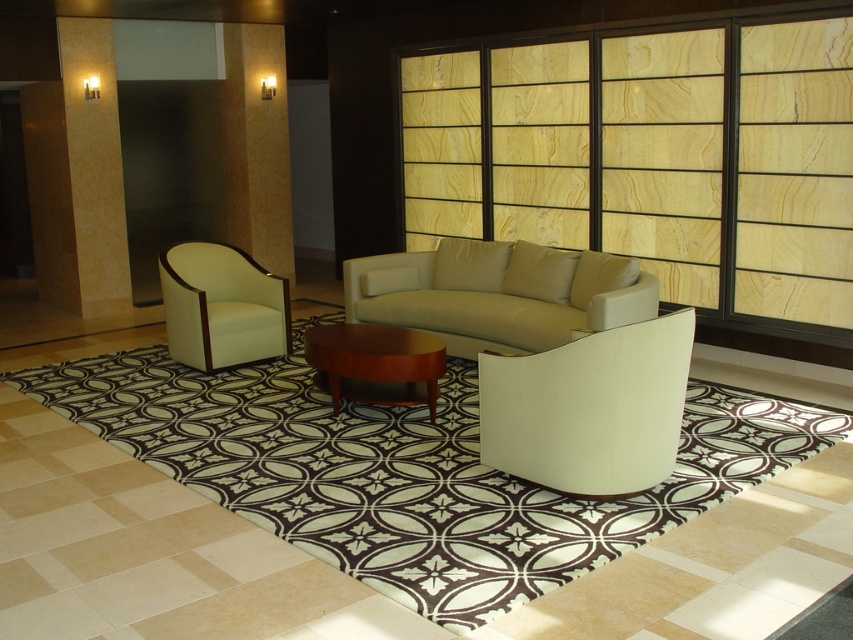
Is beige leather couch at center positioned in front of mahogany wood coffee table at center?

No, beige leather couch at center is behind mahogany wood coffee table at center.

Who is positioned more to the left, beige leather couch at center or mahogany wood coffee table at center?

mahogany wood coffee table at center is more to the left.

Which is behind, point (589, 282) or point (393, 346)?

Point (589, 282)

The image size is (853, 640). In order to click on beige leather couch at center in this screenshot , I will do `click(498, 292)`.

Which is more to the left, white leather chair at center or mahogany wood coffee table at center?

mahogany wood coffee table at center is more to the left.

Which of these two, white leather chair at center or mahogany wood coffee table at center, stands shorter?

Standing shorter between the two is mahogany wood coffee table at center.

Measure the distance between white leather chair at center and camera.

white leather chair at center and camera are 3.28 meters apart.

The width and height of the screenshot is (853, 640). What are the coordinates of `white leather chair at center` in the screenshot? It's located at (589, 406).

Which is above, white leather chair at center or white leather armchair at left?

Positioned higher is white leather armchair at left.

Is point (523, 355) closer to viewer compared to point (186, 356)?

Yes, point (523, 355) is closer to viewer.

The height and width of the screenshot is (640, 853). I want to click on white leather chair at center, so click(x=589, y=406).